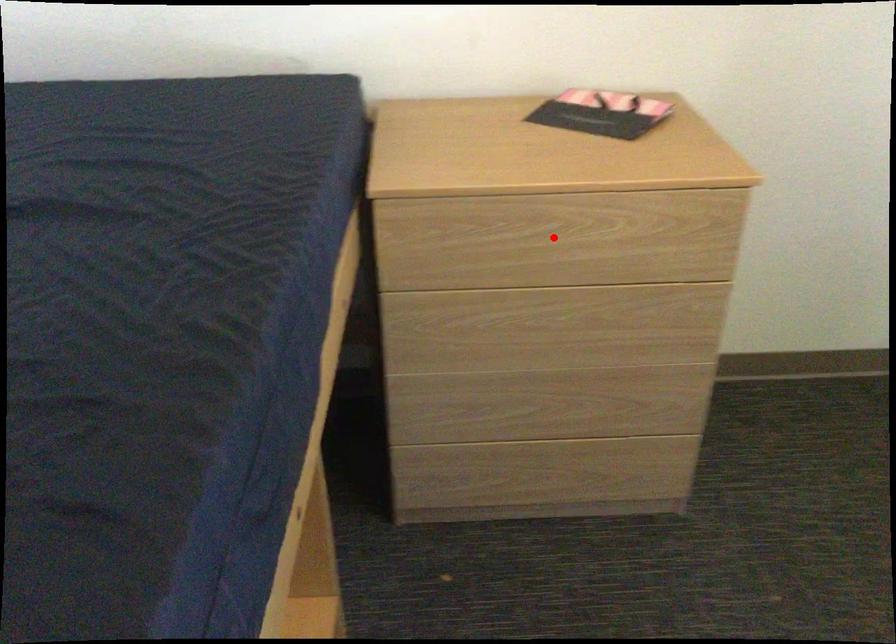
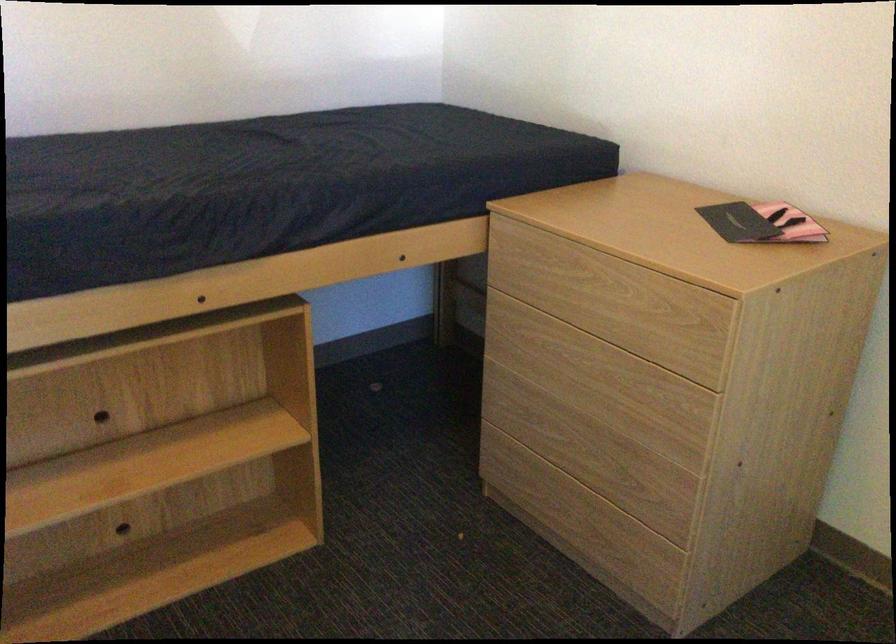
Question: I am providing you with two images of the same scene from different viewpoints. In image1, a red point is highlighted. Considering the same 3D point in image2, which of the following is correct?

Choices:
 (A) It is closer
 (B) It is farther

Answer: (B)